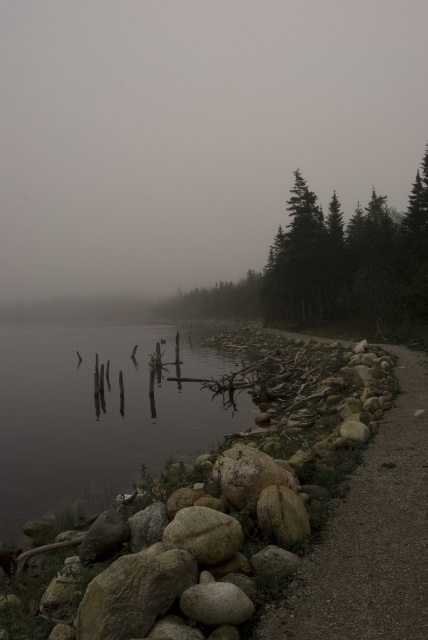
You are a hiker who has just arrived at the lakeside and wants to cross from the dark brown water at left to the green matte tree at center. Given that your hiking boots have a maximum wading depth of 2 feet, can you safely make this journey? Please explain your reasoning based on the scene details provided.

The dark brown water at left and green matte tree at center are 126.35 feet apart from each other. Since the water depth isn answer the question, the distance alone doesn answer the safety of the wading. However, the scene describes the lake as having a calm surface and being surrounded by rocky shoreline with wooden posts, which might indicate shallow areas. Without specific depth information, it is impossible to determine if the entire path has a depth within the 2 feet limit. Therefore, the safety cannot

You are standing at the lakeside and want to take a photo of both the dark brown water at left and the green matte tree at center. Which object should you focus on first to ensure both are in sharp focus?

You should focus on the dark brown water at left first because it is closer to you than the green matte tree at center, so adjusting focus from near to far will help both be in sharp focus.

Looking at this image, you are an environmental scientist assessing the lake for water quality. You observe the dark brown water at left and the green matte tree at center. Which area would you prioritize for testing, and why?

You should prioritize testing the dark brown water at left because it occupies less space than the green matte tree at center, indicating it might be a localized issue requiring immediate attention.